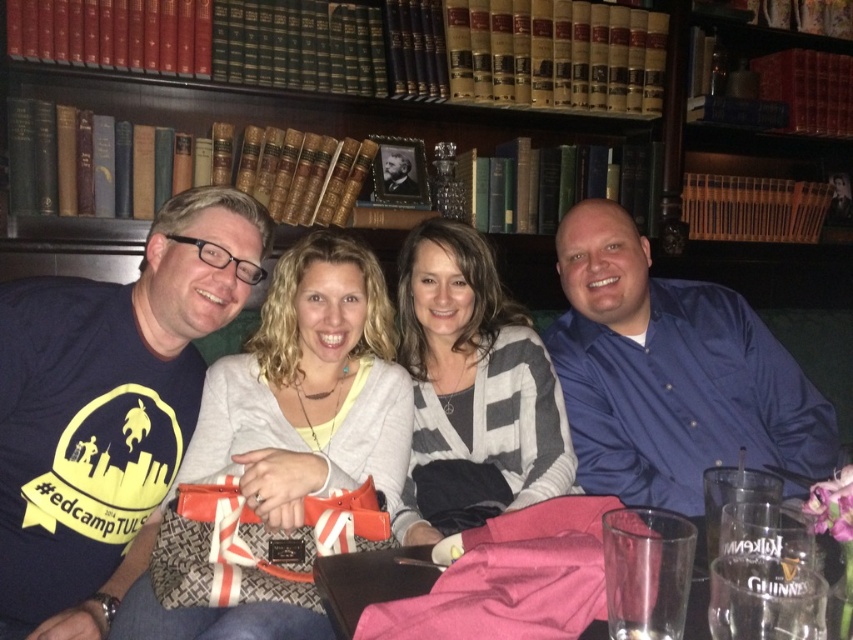
Question: Does matte blue t-shirt at left have a smaller size compared to blue satin shirt at right?

Choices:
 (A) yes
 (B) no

Answer: (A)

Question: Which object is farther from the camera taking this photo?

Choices:
 (A) matte gray sweater at center
 (B) hardcover books at upper center

Answer: (B)

Question: Which is nearer to the striped sweater at center?

Choices:
 (A) matte blue t-shirt at left
 (B) pink fabric at lower center
 (C) blue satin shirt at right
 (D) hardcover books at upper center

Answer: (C)

Question: In this image, where is blue satin shirt at right located relative to hardcover books at upper center?

Choices:
 (A) left
 (B) right

Answer: (B)

Question: Which of the following is the farthest from the observer?

Choices:
 (A) (422, 307)
 (B) (550, 605)

Answer: (A)

Question: Can you confirm if matte black shirt at left is positioned to the left of striped sweater at center?

Choices:
 (A) no
 (B) yes

Answer: (B)